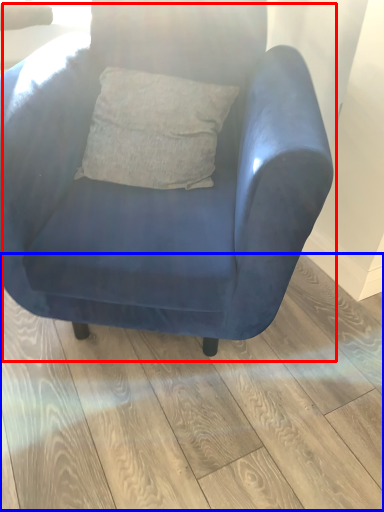
Question: Which object appears closest to the camera in this image, chair (highlighted by a red box) or plank (highlighted by a blue box)?

Choices:
 (A) chair
 (B) plank

Answer: (A)